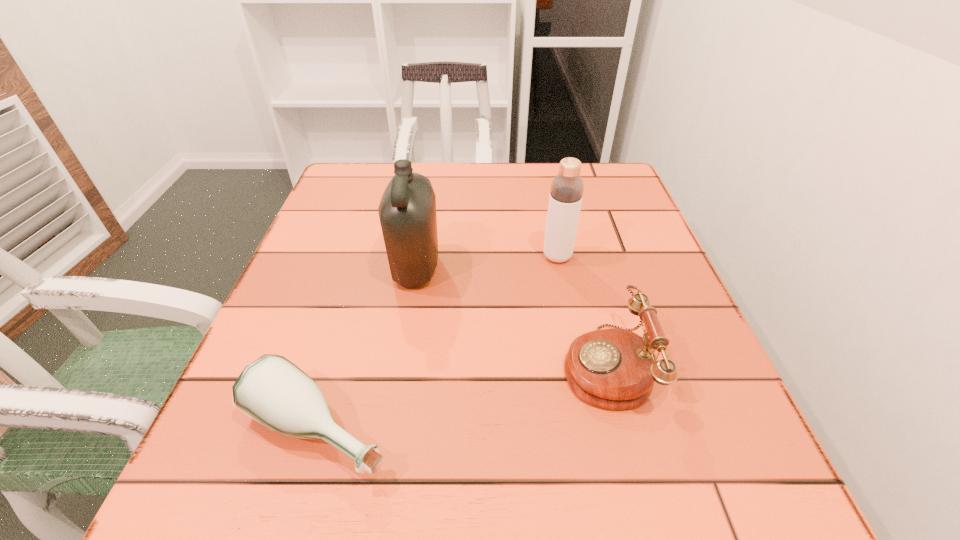
At what (x,y) coordinates should I click in order to perform the action: click on the rightmost bottle. Please return your answer as a coordinate pair (x, y). This screenshot has width=960, height=540. Looking at the image, I should click on (567, 187).

Where is `the third tallest object`? the third tallest object is located at coordinates (615, 369).

You are a GUI agent. You are given a task and a screenshot of the screen. Output one action in this format:
    pyautogui.click(x=<x>, y=<y>)
    Task: Click on the nearest bottle
    Image resolution: width=960 pixels, height=540 pixels.
    Given the screenshot: What is the action you would take?
    pyautogui.click(x=272, y=390)

You are a GUI agent. You are given a task and a screenshot of the screen. Output one action in this format:
    pyautogui.click(x=<x>, y=<y>)
    Task: Click on the shortest bottle
    The image size is (960, 540).
    Given the screenshot: What is the action you would take?
    pyautogui.click(x=272, y=390)

Where is `vacant region located on the left of the rightmost bottle`? This screenshot has width=960, height=540. vacant region located on the left of the rightmost bottle is located at coordinates [x=444, y=256].

Where is `vacant space located 0.140m on the dial of the telephone`? Image resolution: width=960 pixels, height=540 pixels. vacant space located 0.140m on the dial of the telephone is located at coordinates (477, 365).

Where is `vacant space located on the dial of the telephone`? vacant space located on the dial of the telephone is located at coordinates (514, 365).

Where is `vacant point located on the dial of the telephone`? This screenshot has width=960, height=540. vacant point located on the dial of the telephone is located at coordinates (429, 365).

Locate an element on the screen. This screenshot has width=960, height=540. vacant space situated 0.160m on the right of the shortest object is located at coordinates (505, 429).

Where is `object situated at the near edge`? object situated at the near edge is located at coordinates (272, 390).